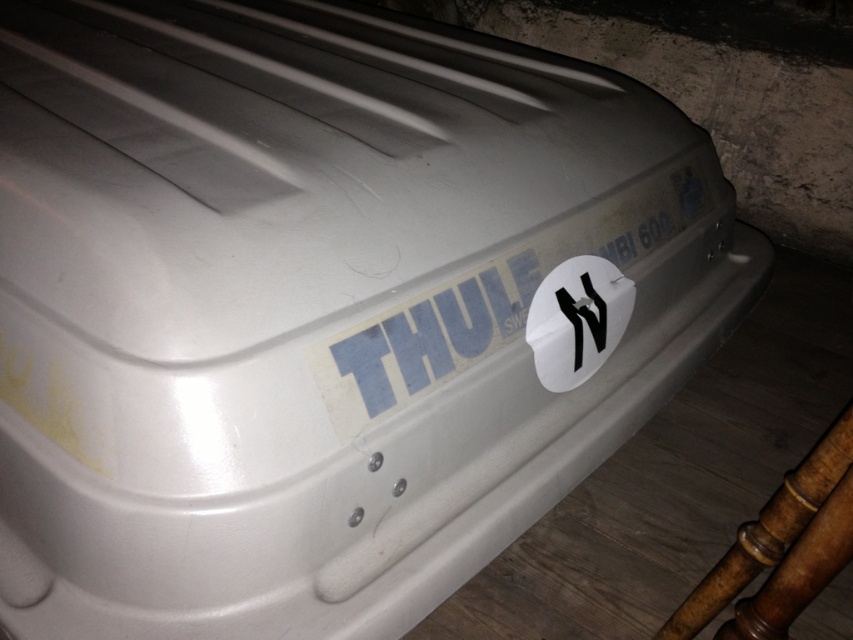
Question: Which point is closer to the camera taking this photo?

Choices:
 (A) (709, 604)
 (B) (618, 273)

Answer: (A)

Question: Does brown wooden stool at lower right have a lesser width compared to white matte sticker at center?

Choices:
 (A) no
 (B) yes

Answer: (B)

Question: Does brown wooden stool at lower right have a lesser width compared to white matte sticker at center?

Choices:
 (A) yes
 (B) no

Answer: (A)

Question: Which point is farther to the camera?

Choices:
 (A) (561, 362)
 (B) (750, 564)

Answer: (A)

Question: Is the position of brown wooden stool at lower right less distant than that of white matte sticker at center?

Choices:
 (A) yes
 (B) no

Answer: (A)

Question: Among these objects, which one is nearest to the camera?

Choices:
 (A) brown wooden stool at lower right
 (B) white matte sticker at center

Answer: (A)